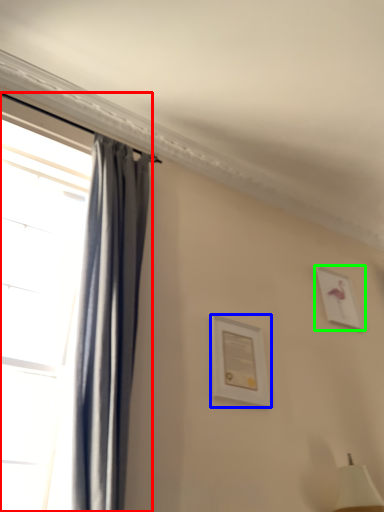
Question: Based on their relative distances, which object is nearer to window (highlighted by a red box)? Choose from picture frame (highlighted by a blue box) and picture frame (highlighted by a green box).

Choices:
 (A) picture frame
 (B) picture frame

Answer: (A)